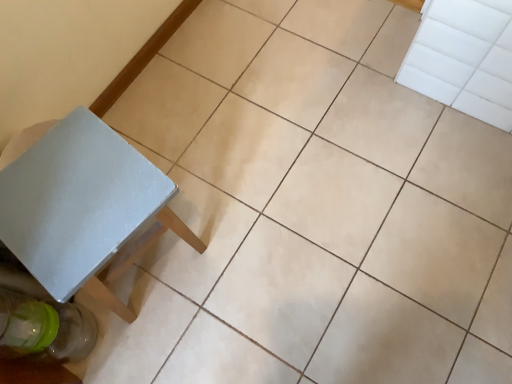
What do you see at coordinates (81, 205) in the screenshot? This screenshot has width=512, height=384. I see `white matte table at lower left` at bounding box center [81, 205].

What is the approximate width of white matte table at lower left?

white matte table at lower left is 12.34 inches in width.

Image resolution: width=512 pixels, height=384 pixels. What are the coordinates of `white matte table at lower left` in the screenshot? It's located at (81, 205).

Image resolution: width=512 pixels, height=384 pixels. Describe the element at coordinates (45, 329) in the screenshot. I see `transparent glass bottle at lower left` at that location.

I want to click on transparent glass bottle at lower left, so click(45, 329).

Locate an element on the screen. This screenshot has height=384, width=512. white matte table at lower left is located at coordinates (81, 205).

Between white matte table at lower left and transparent glass bottle at lower left, which one appears on the left side from the viewer's perspective?

From the viewer's perspective, transparent glass bottle at lower left appears more on the left side.

Which object is closer to the camera, white matte table at lower left or transparent glass bottle at lower left?

white matte table at lower left is closer to the camera.

Considering the points (112, 220) and (77, 311), which point is behind, point (112, 220) or point (77, 311)?

The point (77, 311) is farther from the camera.

From the image's perspective, which is below, white matte table at lower left or transparent glass bottle at lower left?

From the image's view, transparent glass bottle at lower left is below.

From a real-world perspective, who is located lower, white matte table at lower left or transparent glass bottle at lower left?

transparent glass bottle at lower left, from a real-world perspective.

In terms of width, does white matte table at lower left look wider or thinner when compared to transparent glass bottle at lower left?

white matte table at lower left is wider than transparent glass bottle at lower left.

Considering the sizes of objects white matte table at lower left and transparent glass bottle at lower left in the image provided, who is taller, white matte table at lower left or transparent glass bottle at lower left?

With more height is white matte table at lower left.

Is white matte table at lower left smaller than transparent glass bottle at lower left?

Actually, white matte table at lower left might be larger than transparent glass bottle at lower left.

Based on the photo, do you think white matte table at lower left is within transparent glass bottle at lower left, or outside of it?

white matte table at lower left lies outside transparent glass bottle at lower left.

Is white matte table at lower left far away from transparent glass bottle at lower left?

white matte table at lower left is near transparent glass bottle at lower left, not far away.

Is white matte table at lower left positioned with its back to transparent glass bottle at lower left?

No, white matte table at lower left's orientation is not away from transparent glass bottle at lower left.

Locate an element on the screen. The width and height of the screenshot is (512, 384). glass bottle lying below the white matte table at lower left (from the image's perspective) is located at coordinates (45, 329).

Is transparent glass bottle at lower left to the left of white matte table at lower left from the viewer's perspective?

Yes.

Is transparent glass bottle at lower left further to the viewer compared to white matte table at lower left?

Yes, it is.

Between point (25, 347) and point (27, 248), which one is positioned behind?

The point (25, 347) is more distant.

From the image's perspective, is transparent glass bottle at lower left positioned above or below white matte table at lower left?

Based on their image positions, transparent glass bottle at lower left is located beneath white matte table at lower left.

From a real-world perspective, is transparent glass bottle at lower left located higher than white matte table at lower left?

No.

Between transparent glass bottle at lower left and white matte table at lower left, which one has larger width?

white matte table at lower left is wider.

Considering the relative sizes of transparent glass bottle at lower left and white matte table at lower left in the image provided, is transparent glass bottle at lower left shorter than white matte table at lower left?

Yes.

Does transparent glass bottle at lower left have a smaller size compared to white matte table at lower left?

Correct, transparent glass bottle at lower left occupies less space than white matte table at lower left.

Based on the photo, is transparent glass bottle at lower left situated inside white matte table at lower left or outside?

transparent glass bottle at lower left is not enclosed by white matte table at lower left.

Is transparent glass bottle at lower left with white matte table at lower left?

No.

Could you tell me if transparent glass bottle at lower left is turned towards white matte table at lower left?

No, transparent glass bottle at lower left is not aimed at white matte table at lower left.

How different are the orientations of transparent glass bottle at lower left and white matte table at lower left in degrees?

8.6 degrees separate the facing orientations of transparent glass bottle at lower left and white matte table at lower left.

Locate an element on the screen. The image size is (512, 384). table located above the transparent glass bottle at lower left (from the image's perspective) is located at coordinates (81, 205).

Where is `table on the right of the transparent glass bottle at lower left`? The width and height of the screenshot is (512, 384). table on the right of the transparent glass bottle at lower left is located at coordinates (81, 205).

The image size is (512, 384). In order to click on glass bottle behind the white matte table at lower left in this screenshot , I will do `click(45, 329)`.